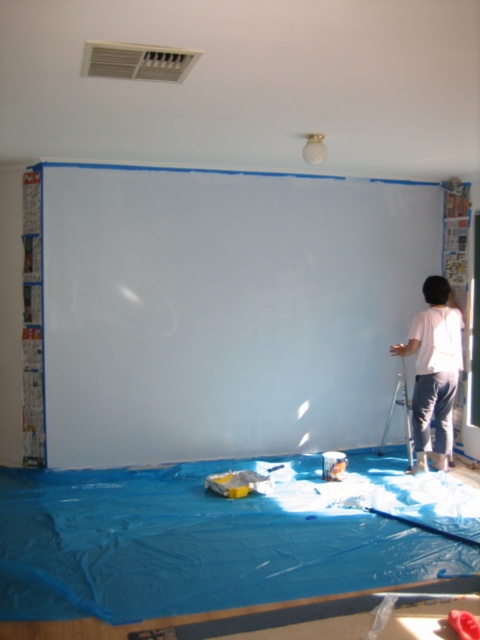
You are a painter who just finished painting the wall. You need to place your white cotton shirt at right and metallic silver ladder at right in a safe spot away from the wet paint. The ladder is heavy. Where should you place them so they are both out of the way and the ladder is stable?

Place the metallic silver ladder at right against a dry wall or in a corner where it can stand stably, and keep the white cotton shirt at right on a clean surface like the blue plastic sheet to avoid paint stains. Ensure they are both away from the wet painted area.

You are a painter standing at the center of the room. You need to move from your current position to pick up a tool located at point (336, 291) and then to another tool at point (396, 401). Which point should you reach first according to their spatial positions?

You should reach point (336, 291) first because it is in front of point (396, 401) from your current position at the center of the room.